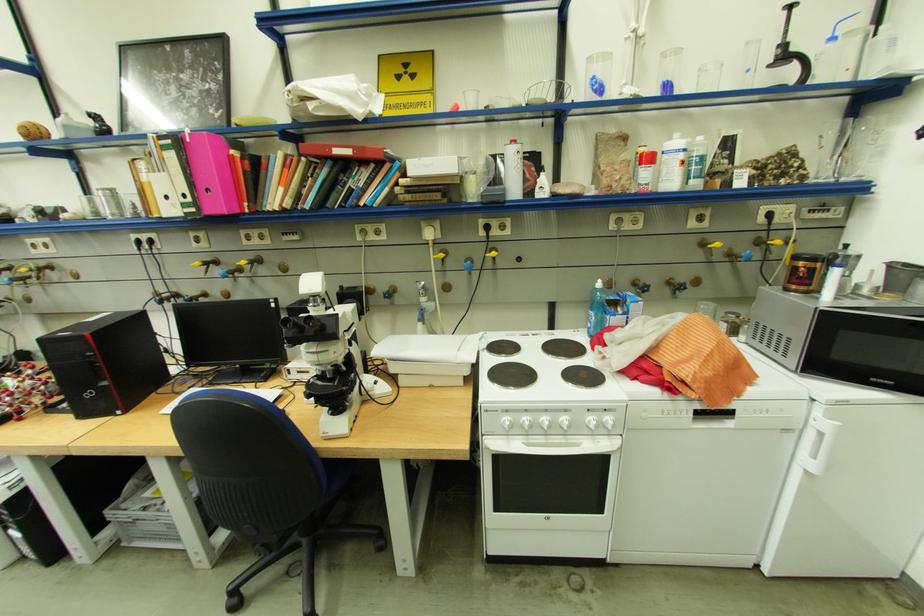
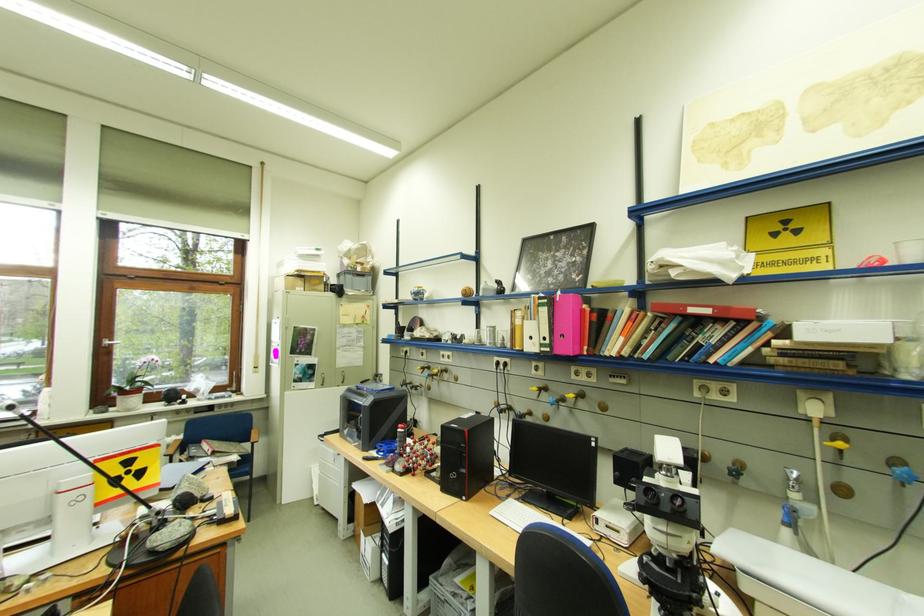
In the second image, find the point that corresponds to (x=203, y=211) in the first image.

(558, 351)